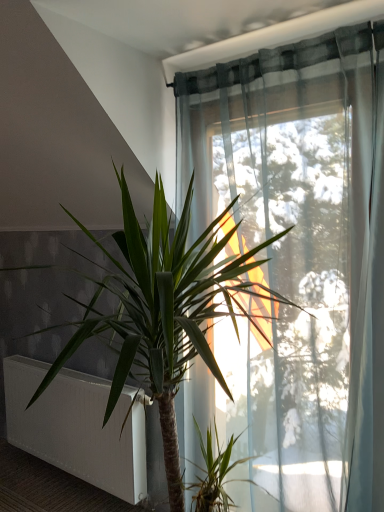
Question: Should I look upward or downward to see white matte radiator at lower left?

Choices:
 (A) up
 (B) down

Answer: (B)

Question: Is green leafy plant at center bigger than white matte radiator at lower left?

Choices:
 (A) yes
 (B) no

Answer: (A)

Question: From a real-world perspective, is green leafy plant at center on white matte radiator at lower left?

Choices:
 (A) yes
 (B) no

Answer: (A)

Question: Is green leafy plant at center in front of white matte radiator at lower left?

Choices:
 (A) yes
 (B) no

Answer: (A)

Question: From a real-world perspective, does green leafy plant at center sit lower than white matte radiator at lower left?

Choices:
 (A) no
 (B) yes

Answer: (A)

Question: Is green leafy plant at center taller than white matte radiator at lower left?

Choices:
 (A) no
 (B) yes

Answer: (B)

Question: Is green leafy plant at center not inside white matte radiator at lower left?

Choices:
 (A) no
 (B) yes

Answer: (B)

Question: Is white matte radiator at lower left wider than green leafy plant at center?

Choices:
 (A) no
 (B) yes

Answer: (A)

Question: Is there a large distance between white matte radiator at lower left and green leafy plant at center?

Choices:
 (A) yes
 (B) no

Answer: (B)

Question: Is white matte radiator at lower left at the left side of green leafy plant at center?

Choices:
 (A) no
 (B) yes

Answer: (B)

Question: Could you tell me if white matte radiator at lower left is turned towards green leafy plant at center?

Choices:
 (A) no
 (B) yes

Answer: (A)

Question: Can you confirm if white matte radiator at lower left is shorter than green leafy plant at center?

Choices:
 (A) no
 (B) yes

Answer: (B)

Question: Is white matte radiator at lower left not within green leafy plant at center?

Choices:
 (A) yes
 (B) no

Answer: (A)

Question: In the image, is green leafy plant at center positioned in front of or behind white matte radiator at lower left?

Choices:
 (A) front
 (B) behind

Answer: (A)